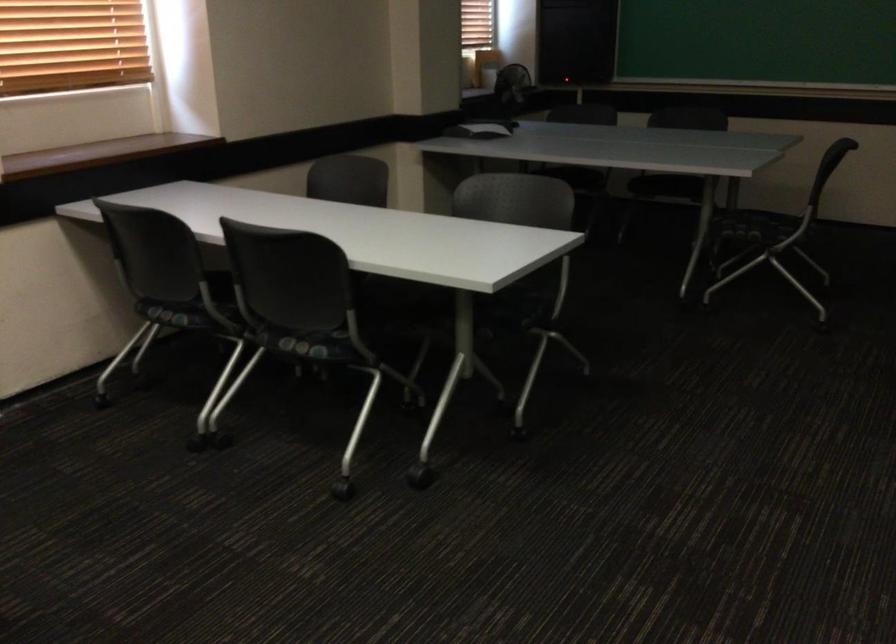
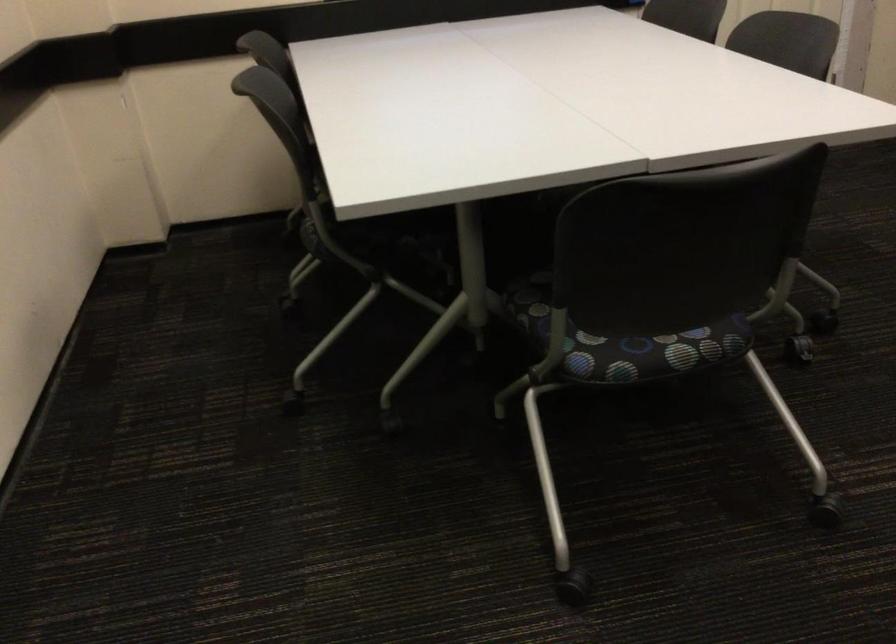
First-person continuous shooting, in which direction is the camera rotating?

The camera rotated toward left-down.